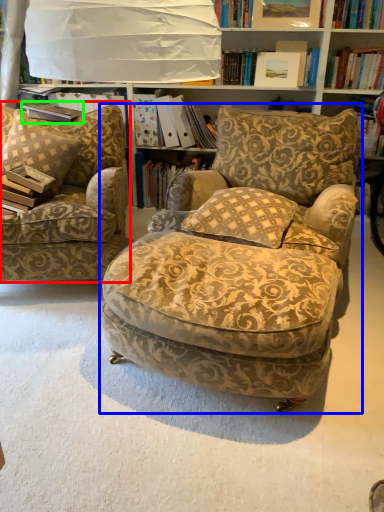
Question: Estimate the real-world distances between objects in this image. Which object is closer to chair (highlighted by a red box), chair (highlighted by a blue box) or paperback book (highlighted by a green box)?

Choices:
 (A) chair
 (B) paperback book

Answer: (B)